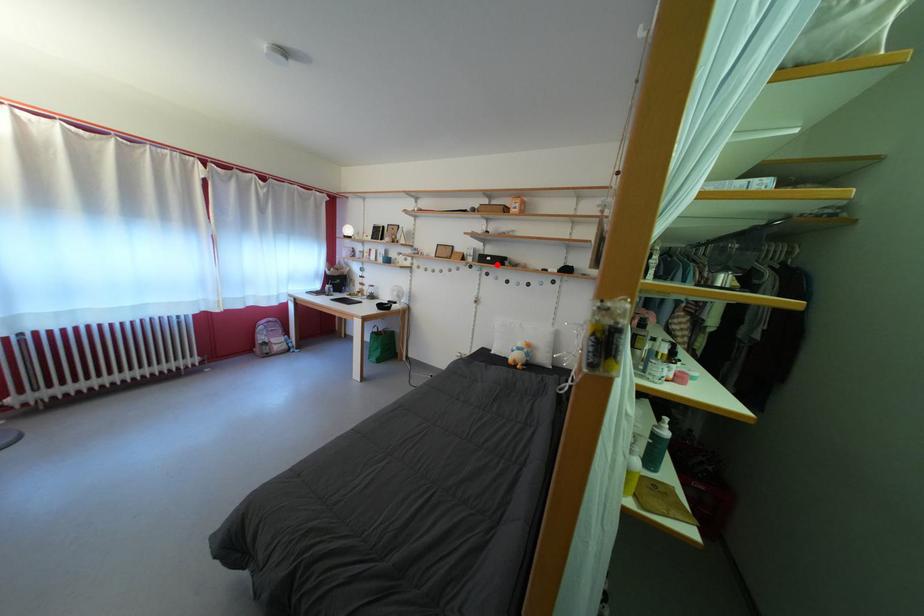
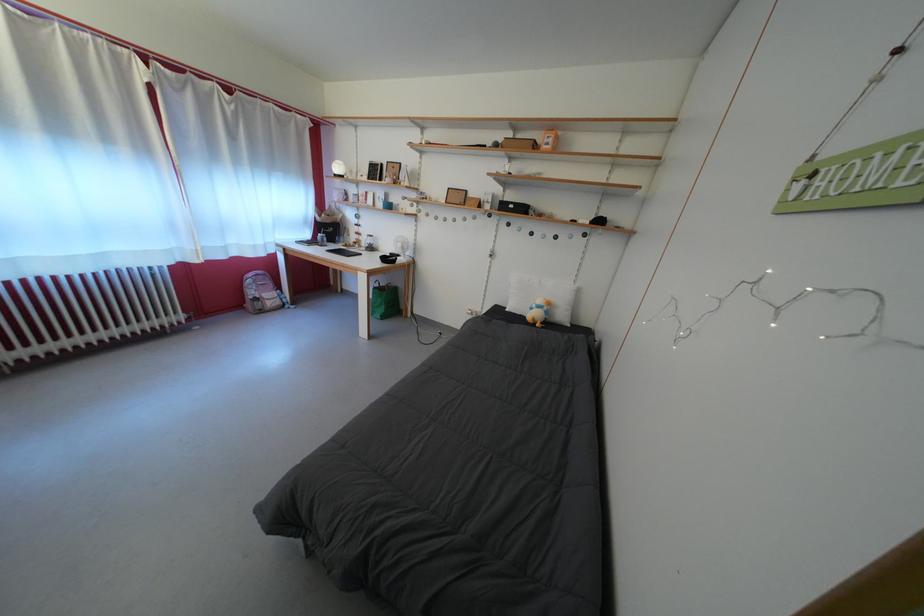
In the second image, find the point that corresponds to the highlighted location in the first image.

(519, 213)